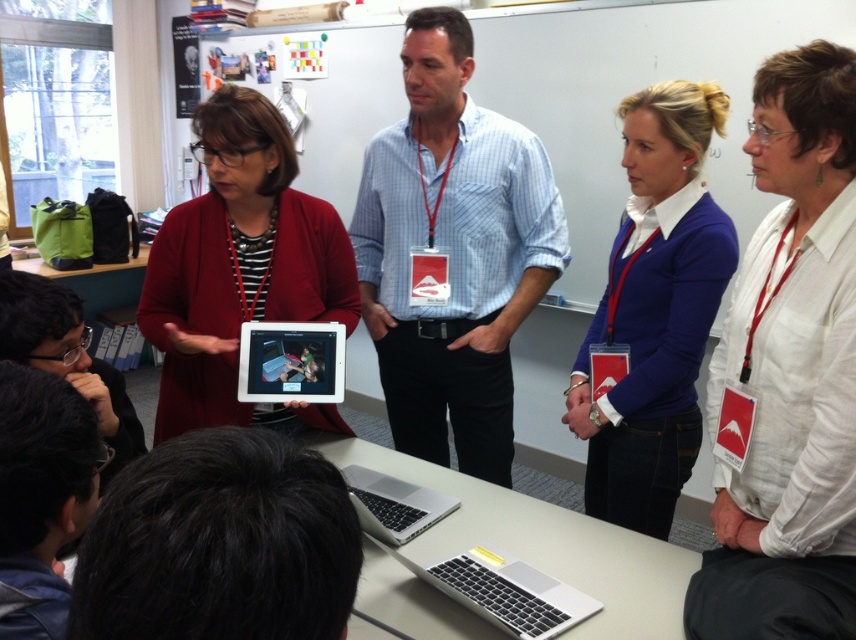
Question: Which object appears closest to the camera in this image?

Choices:
 (A) white linen shirt at upper right
 (B) silver metallic table at center
 (C) silver metallic laptop at center
 (D) matte red cardigan at center

Answer: (A)

Question: Where is silver metallic table at center located in relation to silver metallic tablet at center in the image?

Choices:
 (A) left
 (B) right

Answer: (B)

Question: Is white linen shirt at upper right closer to camera compared to silver metallic table at center?

Choices:
 (A) yes
 (B) no

Answer: (A)

Question: Which point is farther from the camera taking this photo?

Choices:
 (A) (381, 339)
 (B) (391, 564)

Answer: (A)

Question: Can you confirm if blue checkered shirt at center is positioned below silver metallic laptop at center?

Choices:
 (A) yes
 (B) no

Answer: (B)

Question: Which object is the farthest from the silver metallic table at center?

Choices:
 (A) matte red cardigan at center
 (B) dark brown leather jacket at lower left
 (C) matte purple sweater at upper right
 (D) blue checkered shirt at center

Answer: (B)